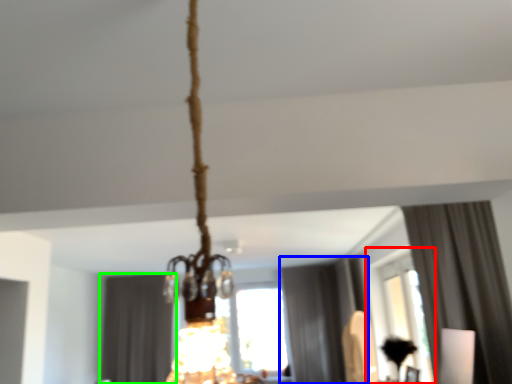
Question: Which object is the closest to the window (highlighted by a red box)? Choose among these: curtain (highlighted by a blue box) or curtain (highlighted by a green box).

Choices:
 (A) curtain
 (B) curtain

Answer: (A)